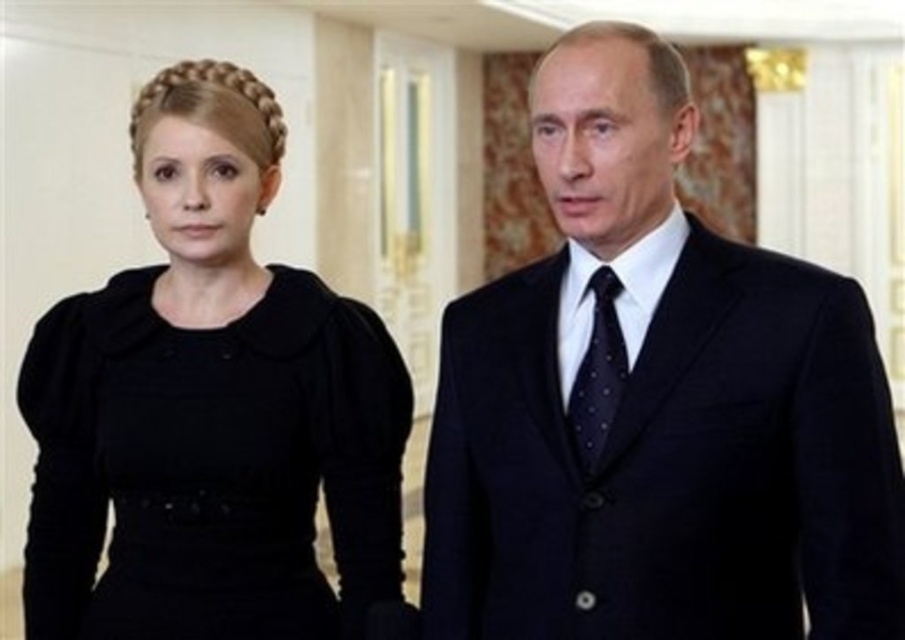
Question: Can you confirm if matte black suit at center is positioned to the right of black velvet dress at left?

Choices:
 (A) yes
 (B) no

Answer: (A)

Question: Can you confirm if matte black suit at center is positioned to the left of dark blue dotted tie at center?

Choices:
 (A) yes
 (B) no

Answer: (B)

Question: Which object is the farthest from the dark blue dotted tie at center?

Choices:
 (A) black velvet dress at left
 (B) matte black suit at center

Answer: (A)

Question: Is matte black suit at center to the left of black velvet dress at left from the viewer's perspective?

Choices:
 (A) no
 (B) yes

Answer: (A)

Question: Estimate the real-world distances between objects in this image. Which object is farther from the matte black suit at center?

Choices:
 (A) dark blue dotted tie at center
 (B) black velvet dress at left

Answer: (B)

Question: Which object is positioned closest to the black velvet dress at left?

Choices:
 (A) dark blue dotted tie at center
 (B) matte black suit at center

Answer: (B)